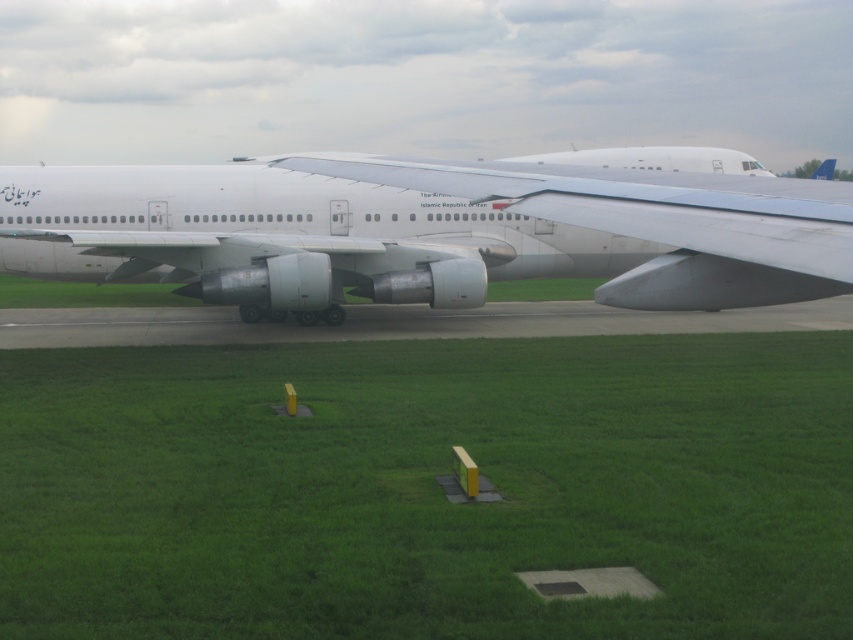
Which is more to the right, green grass at center or white matte tail at upper center?

Positioned to the right is white matte tail at upper center.

Between green grass at center and white matte tail at upper center, which one is positioned higher?

white matte tail at upper center

Identify the location of green grass at center. (427, 486).

You are a GUI agent. You are given a task and a screenshot of the screen. Output one action in this format:
    pyautogui.click(x=<x>, y=<y>)
    Task: Click on the white metallic airplane at center
    Image resolution: width=853 pixels, height=640 pixels.
    Given the screenshot: What is the action you would take?
    pyautogui.click(x=339, y=243)

Can you confirm if white metallic airplane at center is smaller than white matte tail at upper center?

Actually, white metallic airplane at center might be larger than white matte tail at upper center.

Does point (57, 227) lie behind point (830, 161)?

No.

This screenshot has width=853, height=640. I want to click on white metallic airplane at center, so click(x=339, y=243).

Is point (370, 360) closer to camera compared to point (454, 259)?

Yes, point (370, 360) is closer to viewer.

Locate an element on the screen. green grass at center is located at coordinates (427, 486).